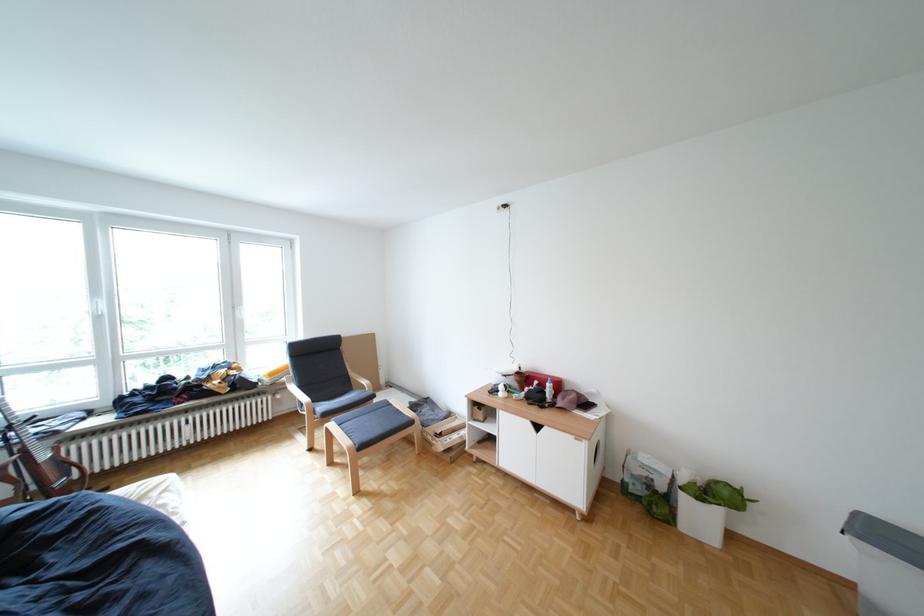
Where would you play the brown acoustic guitar? Please return your answer as a coordinate pair (x, y).

(38, 463)